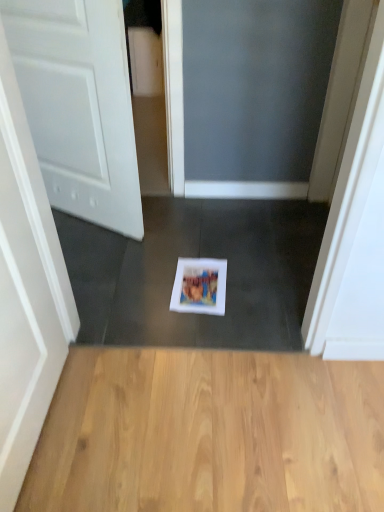
What are the coordinates of `white matte door at left` in the screenshot? It's located at (79, 105).

The image size is (384, 512). Describe the element at coordinates (210, 433) in the screenshot. I see `light brown wood flooring at center` at that location.

You are a GUI agent. You are given a task and a screenshot of the screen. Output one action in this format:
    pyautogui.click(x=<x>, y=<y>)
    Task: Click on the white paper at center
    This screenshot has width=384, height=512.
    Given the screenshot: What is the action you would take?
    pyautogui.click(x=199, y=286)

Are white matte door at left and white paper at center making contact?

There is a gap between white matte door at left and white paper at center.

Considering the relative sizes of white matte door at left and white paper at center in the image provided, is white matte door at left thinner than white paper at center?

Yes, white matte door at left is thinner than white paper at center.

From a real-world perspective, is white matte door at left on white paper at center?

Indeed, from a real-world perspective, white matte door at left stands above white paper at center.

Who is smaller, white matte door at left or white paper at center?

white paper at center.

From the image's perspective, is white paper at center under white matte door at left?

Yes.

What's the angular difference between white paper at center and white matte door at left's facing directions?

154 degrees separate the facing orientations of white paper at center and white matte door at left.

Is white paper at center facing towards white matte door at left?

No, white paper at center is not turned towards white matte door at left.

Between white paper at center and white matte door at left, which one has less height?

With less height is white paper at center.

Which object is closer to the camera taking this photo, white matte door at left or light brown wood flooring at center?

light brown wood flooring at center is closer to the camera.

Is white matte door at left bigger than light brown wood flooring at center?

Yes, white matte door at left is bigger than light brown wood flooring at center.

Where is `hardwood below the white matte door at left (from a real-world perspective)`? hardwood below the white matte door at left (from a real-world perspective) is located at coordinates (210, 433).

In the scene shown: From a real-world perspective, between white paper at center and light brown wood flooring at center, who is vertically higher?

white paper at center, from a real-world perspective.

Locate an element on the screen. The width and height of the screenshot is (384, 512). hardwood on the right of white paper at center is located at coordinates (210, 433).

Which is more to the right, white paper at center or light brown wood flooring at center?

From the viewer's perspective, light brown wood flooring at center appears more on the right side.

Is white paper at center not close to light brown wood flooring at center?

white paper at center is near light brown wood flooring at center, not far away.

From the image's perspective, which one is positioned higher, light brown wood flooring at center or white paper at center?

white paper at center.

Does point (342, 496) come farther from viewer compared to point (181, 301)?

No, (342, 496) is closer to viewer.

Is the depth of light brown wood flooring at center greater than that of white paper at center?

No, light brown wood flooring at center is in front of white paper at center.

Is light brown wood flooring at center shorter than white paper at center?

No, light brown wood flooring at center is not shorter than white paper at center.

From their relative heights in the image, would you say light brown wood flooring at center is taller or shorter than white matte door at left?

In the image, light brown wood flooring at center appears to be shorter than white matte door at left.

Between light brown wood flooring at center and white matte door at left, which one is positioned in front?

Positioned in front is light brown wood flooring at center.

From the image's perspective, is light brown wood flooring at center above or below white matte door at left?

light brown wood flooring at center is below white matte door at left.

Does light brown wood flooring at center contain white matte door at left?

No.

This screenshot has width=384, height=512. I want to click on door on the left of white paper at center, so pyautogui.click(x=79, y=105).

You are a GUI agent. You are given a task and a screenshot of the screen. Output one action in this format:
    pyautogui.click(x=<x>, y=<y>)
    Task: Click on the copy below the white matte door at left (from a real-world perspective)
    The height and width of the screenshot is (512, 384).
    Given the screenshot: What is the action you would take?
    pyautogui.click(x=199, y=286)

From the image, which object appears to be nearer to white matte door at left, white paper at center or light brown wood flooring at center?

Among the two, white paper at center is located nearer to white matte door at left.

When comparing their distances from white paper at center, does light brown wood flooring at center or white matte door at left seem further?

Among the two, white matte door at left is located further to white paper at center.

From the image, which object appears to be farther from light brown wood flooring at center, white matte door at left or white paper at center?

Among the two, white matte door at left is located further to light brown wood flooring at center.

Considering their positions, is light brown wood flooring at center positioned closer to white matte door at left than white paper at center?

The object closer to white matte door at left is white paper at center.

Consider the image. Estimate the real-world distances between objects in this image. Which object is further from white paper at center, white matte door at left or light brown wood flooring at center?

white matte door at left lies further to white paper at center than the other object.

Considering their positions, is white paper at center positioned closer to light brown wood flooring at center than white matte door at left?

white paper at center is positioned closer to the anchor light brown wood flooring at center.

Where is `copy between white matte door at left and light brown wood flooring at center from top to bottom`? The image size is (384, 512). copy between white matte door at left and light brown wood flooring at center from top to bottom is located at coordinates (199, 286).